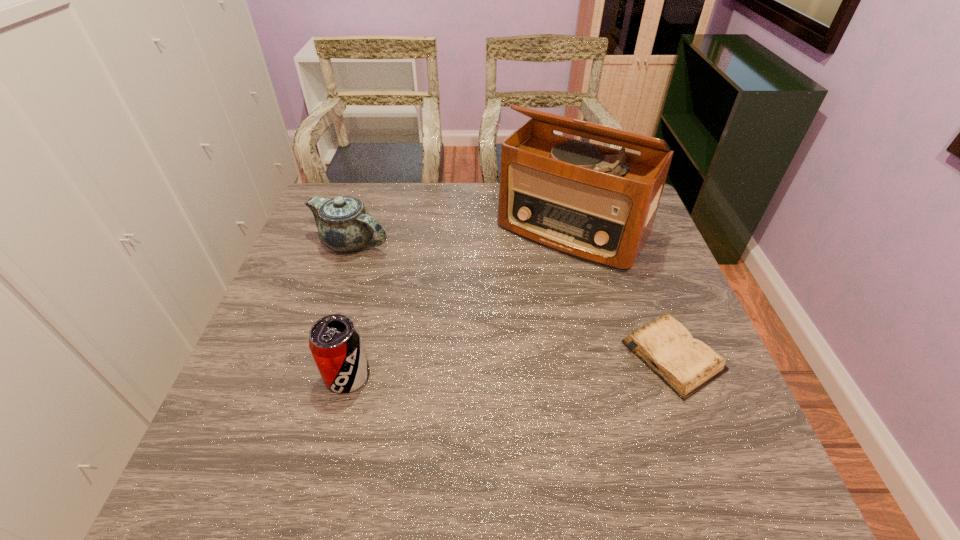
Locate an element on the screen. Image resolution: width=960 pixels, height=540 pixels. vacant space located from the spout of the chinaware is located at coordinates (453, 316).

Where is `vacant area located from the spout of the chinaware`? This screenshot has height=540, width=960. vacant area located from the spout of the chinaware is located at coordinates (427, 295).

Find the location of `object that is at the far edge`. object that is at the far edge is located at coordinates (595, 203).

Locate an element on the screen. The height and width of the screenshot is (540, 960). object that is positioned at the near edge is located at coordinates (686, 364).

The height and width of the screenshot is (540, 960). What are the coordinates of `object positioned at the left edge` in the screenshot? It's located at (344, 225).

The width and height of the screenshot is (960, 540). I want to click on diary present at the right edge, so click(x=686, y=364).

This screenshot has width=960, height=540. Identify the location of radio receiver present at the right edge. (595, 203).

Locate an element on the screen. Image resolution: width=960 pixels, height=540 pixels. object that is at the far right corner is located at coordinates (595, 203).

At what (x,y) coordinates should I click in order to perform the action: click on object at the near right corner. Please return your answer as a coordinate pair (x, y). Looking at the image, I should click on (686, 364).

Locate an element on the screen. vacant region at the far edge of the desktop is located at coordinates (457, 215).